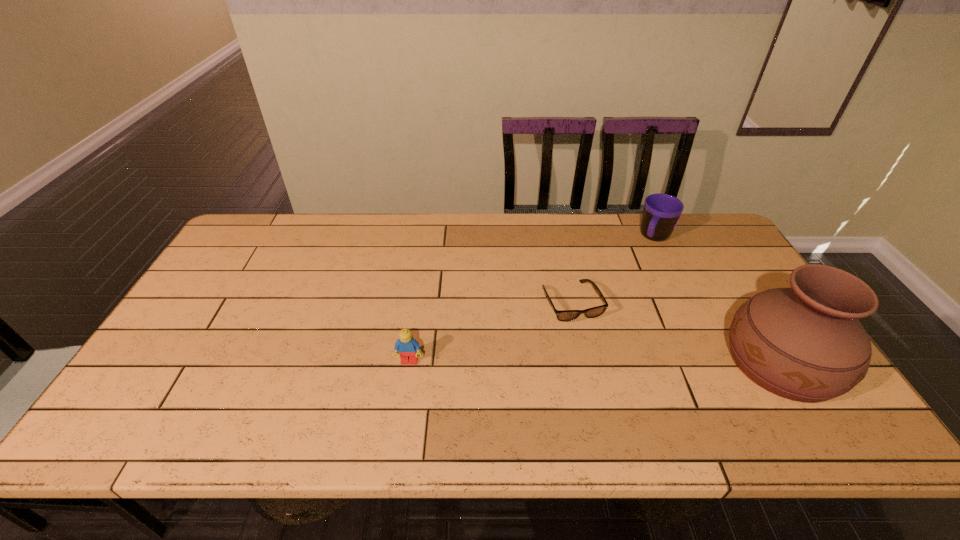
Where is `free space located on the lenses of the spectacles`? This screenshot has height=540, width=960. free space located on the lenses of the spectacles is located at coordinates (602, 368).

At what (x,y) coordinates should I click in order to perform the action: click on vacant space located on the lenses of the spectacles. Please return your answer as a coordinate pair (x, y). The image size is (960, 540). Looking at the image, I should click on (590, 343).

The width and height of the screenshot is (960, 540). I want to click on object located at the far edge, so click(661, 213).

Where is `object located in the near edge section of the desktop`? This screenshot has height=540, width=960. object located in the near edge section of the desktop is located at coordinates (805, 343).

Find the location of a particular element. The height and width of the screenshot is (540, 960). object at the right edge is located at coordinates (805, 343).

Image resolution: width=960 pixels, height=540 pixels. I want to click on object present at the near right corner, so click(805, 343).

In the image, there is a desktop. Identify the location of vacant space at the far edge. The height and width of the screenshot is (540, 960). (613, 237).

The image size is (960, 540). Find the location of `vacant space at the left edge`. vacant space at the left edge is located at coordinates (233, 282).

This screenshot has height=540, width=960. I want to click on vacant space at the right edge of the desktop, so click(x=727, y=304).

Identify the location of vacant space at the far right corner of the desktop. (683, 232).